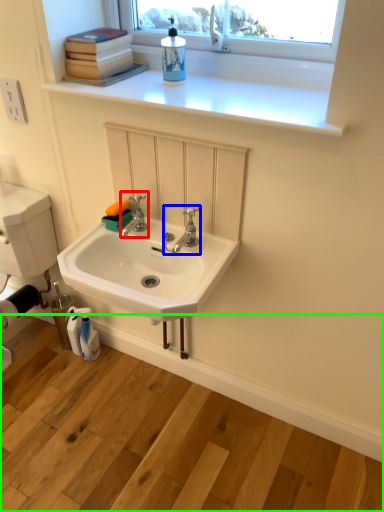
Question: Which is farther away from tap (highlighted by a red box)? tap (highlighted by a blue box) or counter (highlighted by a green box)?

Choices:
 (A) tap
 (B) counter

Answer: (B)